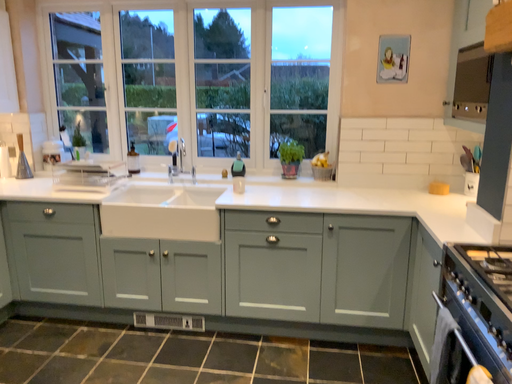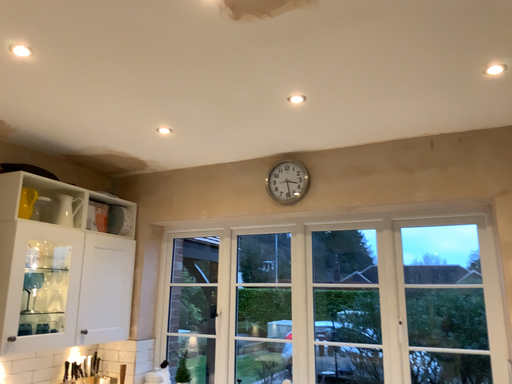
Question: Which way did the camera rotate in the video?

Choices:
 (A) rotated left
 (B) rotated right

Answer: (A)